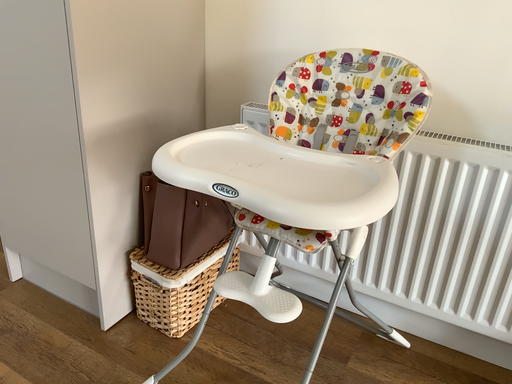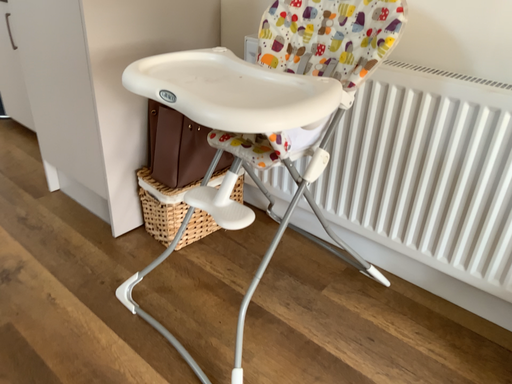
Question: How did the camera likely rotate when shooting the video?

Choices:
 (A) rotated left
 (B) rotated right

Answer: (A)